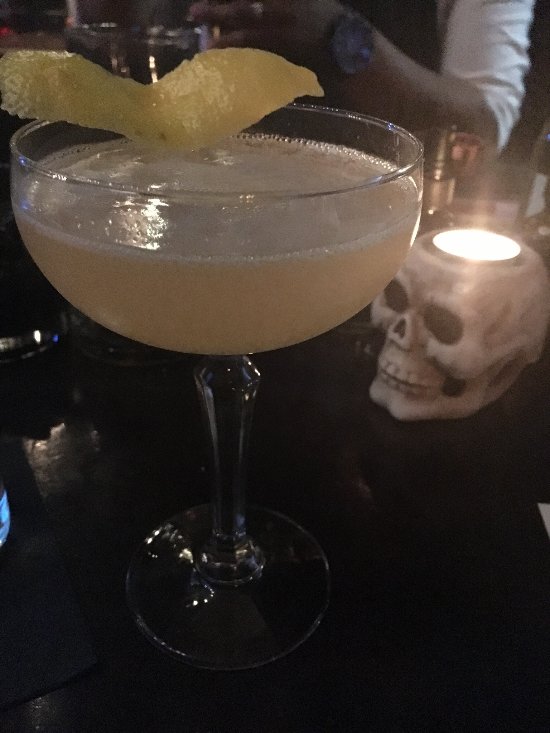
This screenshot has height=733, width=550. I want to click on napkin, so click(x=49, y=627).